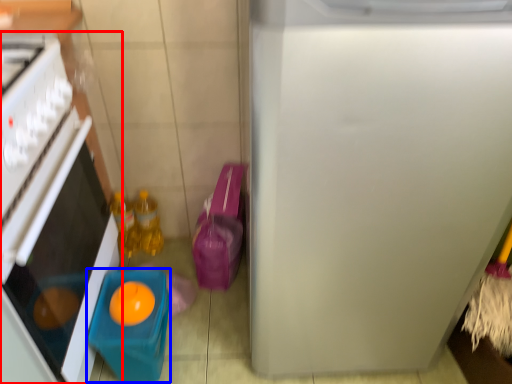
Question: Among these objects, which one is nearest to the camera, home appliance (highlighted by a red box) or toy (highlighted by a blue box)?

Choices:
 (A) home appliance
 (B) toy

Answer: (A)